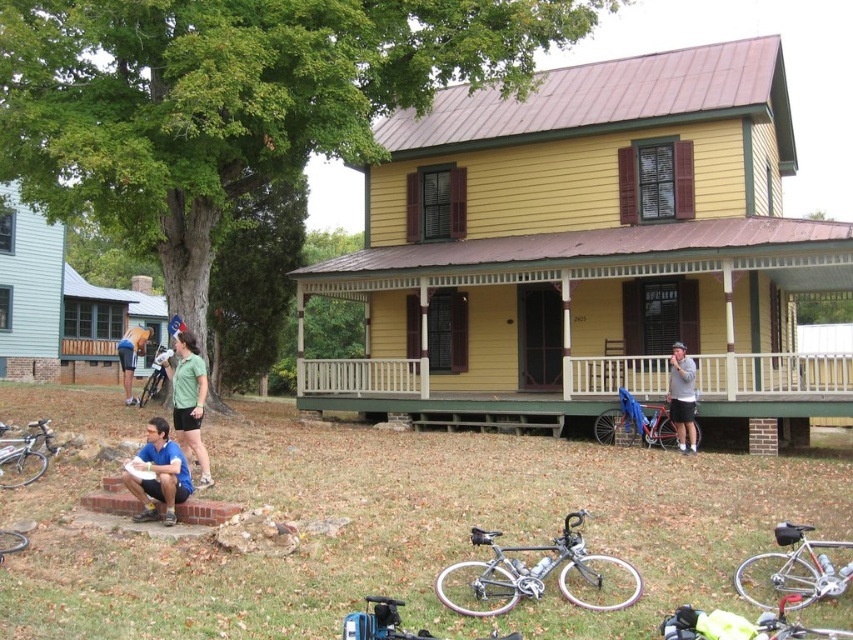
Question: Is the position of silver metallic bicycle at lower right more distant than that of silver metallic bicycle at lower left?

Choices:
 (A) yes
 (B) no

Answer: (B)

Question: Considering the relative positions of silver metallic bicycle at lower left and brushed metal bicycle at left in the image provided, where is silver metallic bicycle at lower left located with respect to brushed metal bicycle at left?

Choices:
 (A) left
 (B) right

Answer: (B)

Question: Estimate the real-world distances between objects in this image. Which object is closer to the red metallic bicycle at center-right?

Choices:
 (A) shiny metallic bicycle at center
 (B) silver metallic bicycle at lower right

Answer: (B)

Question: Which point is farther to the camera?

Choices:
 (A) (672, 388)
 (B) (163, 352)

Answer: (B)

Question: Which point appears farthest from the camera in this image?

Choices:
 (A) pyautogui.click(x=173, y=468)
 (B) pyautogui.click(x=41, y=468)

Answer: (B)

Question: Is red metallic bicycle at center-right above silver metallic bicycle at lower left?

Choices:
 (A) yes
 (B) no

Answer: (B)